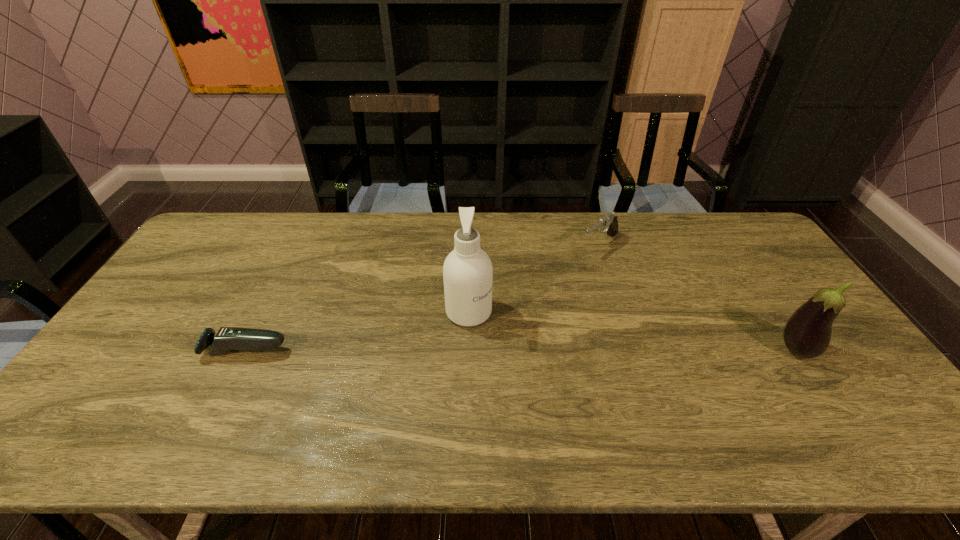
Where is `free point between the tallest object and the electric shaver`? Image resolution: width=960 pixels, height=540 pixels. free point between the tallest object and the electric shaver is located at coordinates (357, 331).

Find the location of a particular element. This screenshot has height=540, width=960. free area in between the gun and the electric shaver is located at coordinates (422, 297).

What are the coordinates of `vacant space in between the third shortest object and the third tallest object` in the screenshot? It's located at coord(698,297).

Locate an element on the screen. The image size is (960, 540). unoccupied position between the second farthest object and the electric shaver is located at coordinates (357, 331).

I want to click on object that is the second closest one to the second shortest object, so click(x=807, y=333).

Locate which object is the second closest to the cleansing agent. Please provide its 2D coordinates. Your answer should be formatted as a tuple, i.e. [(x, y)], where the tuple contains the x and y coordinates of a point satisfying the conditions above.

[(227, 338)]

This screenshot has width=960, height=540. In order to click on free space in the image that satisfies the following two spatial constraints: 1. on the front side of the farthest object; 2. on the left side of the eggplant in this screenshot , I will do `click(635, 350)`.